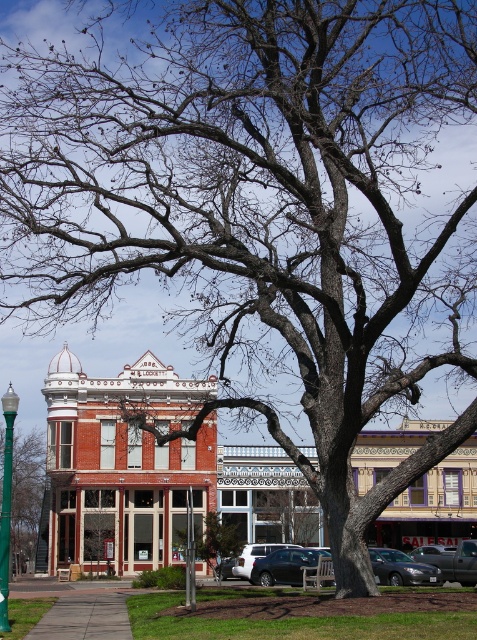
Who is more forward, [428,493] or [303,560]?

Point [303,560] is more forward.

Is red brick building at center taller than metallic silver car at lower center?

Indeed, red brick building at center has a greater height compared to metallic silver car at lower center.

Is point (184, 458) positioned after point (301, 554)?

Yes, point (184, 458) is farther from viewer.

Find the location of `red brick building at center`. red brick building at center is located at coordinates (155, 470).

This screenshot has width=477, height=640. I want to click on gray concrete sidewalk at lower left, so click(x=84, y=618).

Who is more forward, (48, 637) or (12, 390)?

Point (48, 637)

Who is more forward, (75, 620) or (8, 589)?

Point (8, 589)

Find the location of a particular element. The image size is (477, 640). gray concrete sidewalk at lower left is located at coordinates (84, 618).

Does green metallic pole at left have a lesser width compared to gray concrete sidewalk at lower left?

No, green metallic pole at left is not thinner than gray concrete sidewalk at lower left.

Does green metallic pole at left have a lesser height compared to gray concrete sidewalk at lower left?

Incorrect, green metallic pole at left's height does not fall short of gray concrete sidewalk at lower left's.

You are a GUI agent. You are given a task and a screenshot of the screen. Output one action in this format:
    pyautogui.click(x=<x>, y=<y>)
    Task: Click on the green metallic pole at left
    Image resolution: width=477 pixels, height=640 pixels.
    Given the screenshot: What is the action you would take?
    pyautogui.click(x=26, y=497)